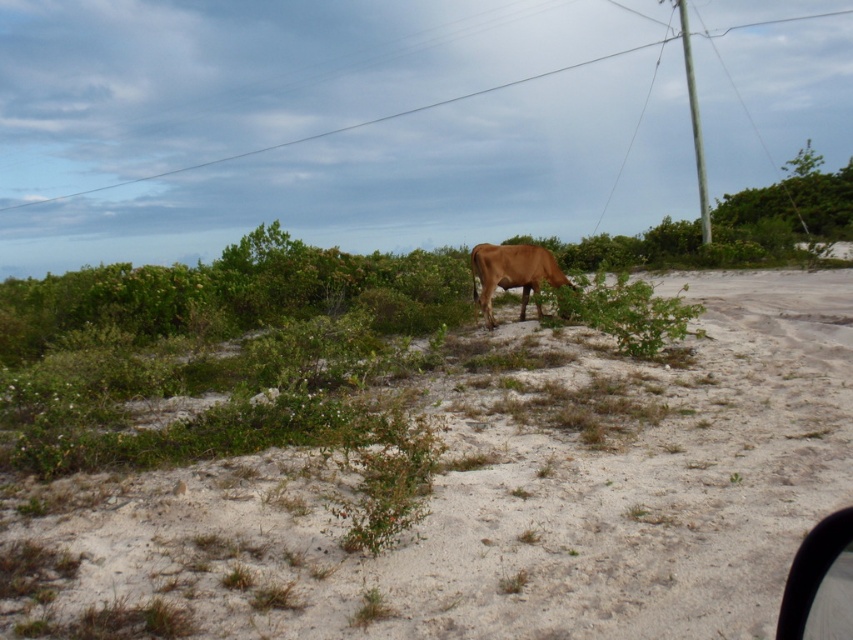
You are standing in a rural area and see the brown sandy soil at center and the brown matte cow at center. Which object is nearer to you?

The brown sandy soil at center is closer to the viewer than the brown matte cow at center.

You are standing at the origin point in the image. You want to walk to the brown sandy soil at center. In which direction should you move relative to your current position?

The brown sandy soil at center is located at point 0.773 on the x axis and 0.591 on the y axis. Since the coordinate system is normalized between 0 and 1, moving towards the right and slightly upwards from the origin would lead you to the brown sandy soil at center.